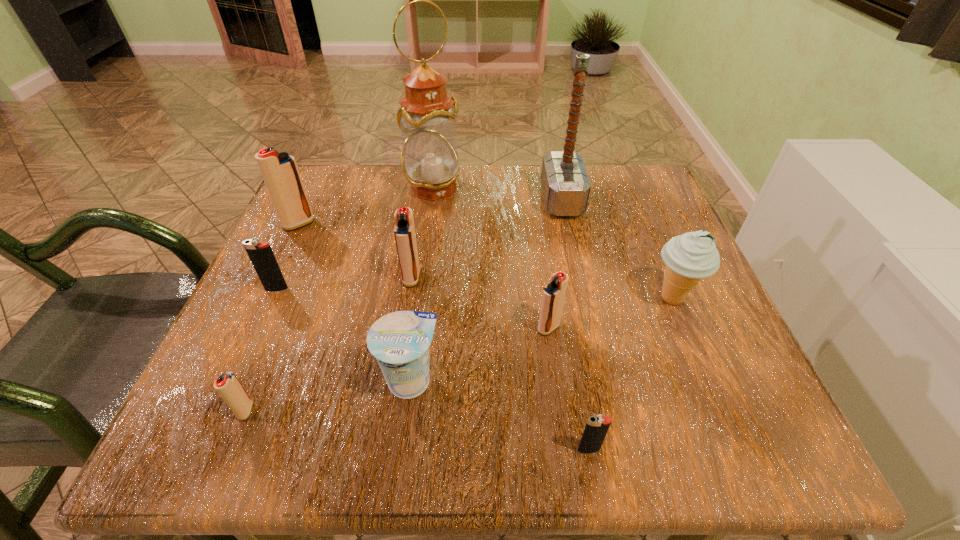
Locate an element on the screen. This screenshot has height=540, width=960. unoccupied area between the fourth igniter from right to left and the icecream is located at coordinates (459, 354).

Locate an element on the screen. Image resolution: width=960 pixels, height=540 pixels. free area in between the icecream and the oil lamp is located at coordinates (553, 243).

What are the coordinates of `vacant point located between the farther black igniter and the tallest object` in the screenshot? It's located at (355, 239).

Locate which object is the second closest to the rightmost object. Please provide its 2D coordinates. Your answer should be formatted as a tuple, i.e. [(x, y)], where the tuple contains the x and y coordinates of a point satisfying the conditions above.

[(565, 184)]

This screenshot has width=960, height=540. Find the location of `object that stands as the ninth closest to the second farthest red igniter`. object that stands as the ninth closest to the second farthest red igniter is located at coordinates (689, 257).

Where is `the closest igniter to the fifth shortest igniter`? This screenshot has width=960, height=540. the closest igniter to the fifth shortest igniter is located at coordinates (261, 255).

Find the location of a particular element. This screenshot has width=960, height=540. igniter identified as the fifth closest to the second biggest red igniter is located at coordinates (597, 426).

Where is `red igniter that stands as the third closest to the nearer black igniter`? The width and height of the screenshot is (960, 540). red igniter that stands as the third closest to the nearer black igniter is located at coordinates (x=228, y=386).

Identify which red igniter is the fourth nearest to the icecream. Please provide its 2D coordinates. Your answer should be formatted as a tuple, i.e. [(x, y)], where the tuple contains the x and y coordinates of a point satisfying the conditions above.

[(280, 172)]

Find the location of a particular element. blank space that satisfies the following two spatial constraints: 1. on the front side of the fourth farthest igniter; 2. on the left side of the second red igniter from right to left is located at coordinates (404, 327).